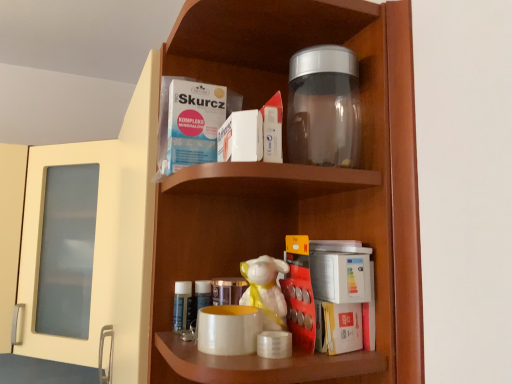
Question: Does matte white mug at center have a greater height compared to white glossy figurine at center?

Choices:
 (A) no
 (B) yes

Answer: (A)

Question: Is matte white mug at center facing away from white glossy figurine at center?

Choices:
 (A) yes
 (B) no

Answer: (B)

Question: From the image's perspective, would you say matte white mug at center is shown under white glossy figurine at center?

Choices:
 (A) no
 (B) yes

Answer: (B)

Question: Considering the relative sizes of matte white mug at center and white glossy figurine at center in the image provided, is matte white mug at center wider than white glossy figurine at center?

Choices:
 (A) no
 (B) yes

Answer: (B)

Question: Is matte white mug at center behind white glossy figurine at center?

Choices:
 (A) yes
 (B) no

Answer: (B)

Question: From the image's perspective, would you say matte white mug at center is positioned over white glossy figurine at center?

Choices:
 (A) no
 (B) yes

Answer: (A)

Question: Is matte white mug at center to the right of transparent plastic jar at upper center from the viewer's perspective?

Choices:
 (A) yes
 (B) no

Answer: (B)

Question: Does matte white mug at center appear on the left side of transparent plastic jar at upper center?

Choices:
 (A) yes
 (B) no

Answer: (A)

Question: Does matte white mug at center turn towards transparent plastic jar at upper center?

Choices:
 (A) yes
 (B) no

Answer: (B)

Question: Can we say matte white mug at center lies outside transparent plastic jar at upper center?

Choices:
 (A) yes
 (B) no

Answer: (A)

Question: Is matte white mug at center smaller than transparent plastic jar at upper center?

Choices:
 (A) yes
 (B) no

Answer: (A)

Question: Does matte white mug at center have a greater width compared to transparent plastic jar at upper center?

Choices:
 (A) no
 (B) yes

Answer: (A)

Question: Considering the relative positions of transparent glass jar at upper center and white glossy figurine at center in the image provided, is transparent glass jar at upper center behind white glossy figurine at center?

Choices:
 (A) no
 (B) yes

Answer: (A)